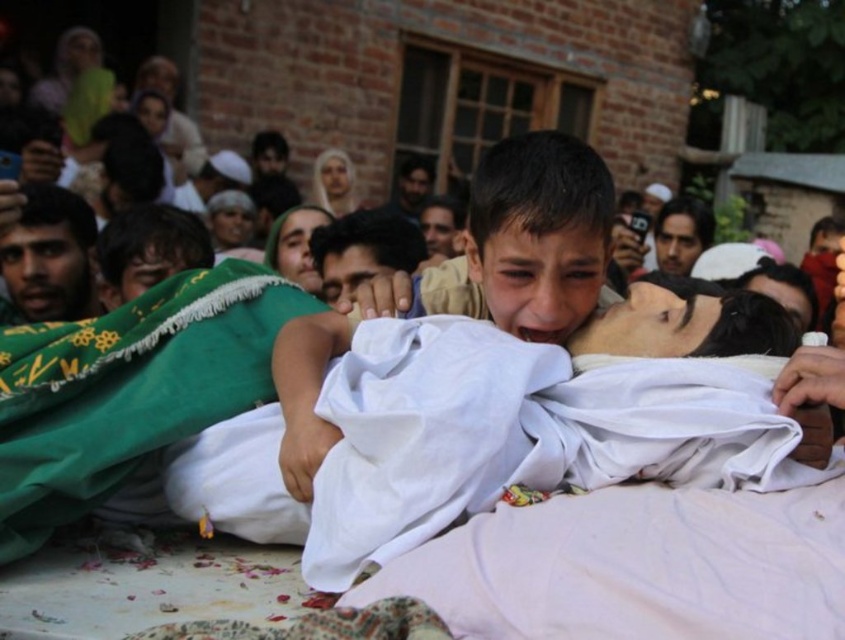
You are a photographer trying to capture the scene of the boy and the deceased person. You notice the green fabric blanket at center and the smooth skin face at center. Which object would you need to adjust your camera focus on first if you want to ensure both are in focus, considering their sizes?

The green fabric blanket at center is bigger than the smooth skin face at center, so you should focus on the green fabric blanket at center first to ensure both are in focus, as larger objects require adjusting focus to capture details properly.

From the picture: You are a photographer standing 5 meters away from the dark brown skin at left and smooth skin face at upper center. Can you take a photo that captures both objects in the same frame without moving your position?

Answer: The dark brown skin at left and smooth skin face at upper center are 11.73 meters apart. Since you are standing 5 meters away from them, the distance between the two objects is greater than your distance from them, so they would likely be out of the same frame. You would need to move closer or use a wider lens to capture both.